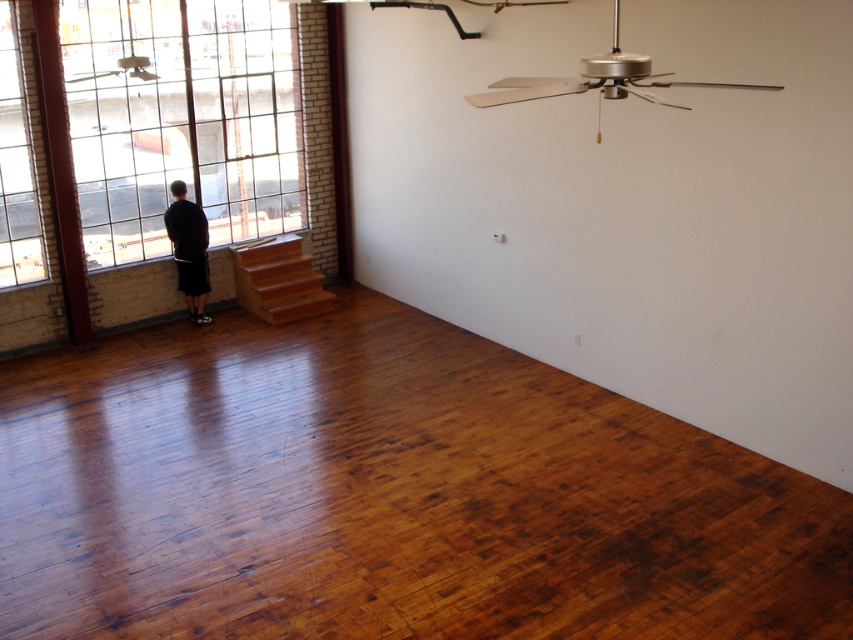
Question: Can you confirm if shiny brown hardwood floor at center is wider than clear glass window at upper left?

Choices:
 (A) yes
 (B) no

Answer: (A)

Question: Which of these objects is positioned closest to the clear glass window at left?

Choices:
 (A) clear glass window at upper left
 (B) black matte shorts at left
 (C) shiny brown hardwood floor at center

Answer: (B)

Question: Is shiny brown hardwood floor at center to the left of clear glass window at left from the viewer's perspective?

Choices:
 (A) no
 (B) yes

Answer: (A)

Question: Can you confirm if clear glass window at left is bigger than black matte shorts at left?

Choices:
 (A) yes
 (B) no

Answer: (A)

Question: Which point appears farthest from the camera in this image?

Choices:
 (A) 171,188
 (B) 15,275
 (C) 292,326
 (D) 131,177

Answer: (D)

Question: Which object is closer to the camera taking this photo?

Choices:
 (A) clear glass window at left
 (B) clear glass window at upper left
 (C) black matte shorts at left

Answer: (A)